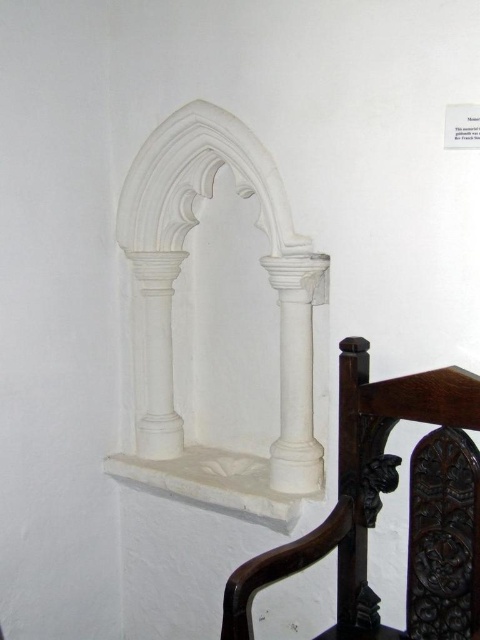
Can you confirm if brown carved wood chair at lower right is positioned to the right of white marble column at center?

Yes, brown carved wood chair at lower right is to the right of white marble column at center.

Is brown carved wood chair at lower right in front of white marble column at center?

That is True.

Does point (346, 477) lie in front of point (300, 474)?

Yes, it is.

Where is `brown carved wood chair at lower right`? The width and height of the screenshot is (480, 640). brown carved wood chair at lower right is located at coordinates (381, 506).